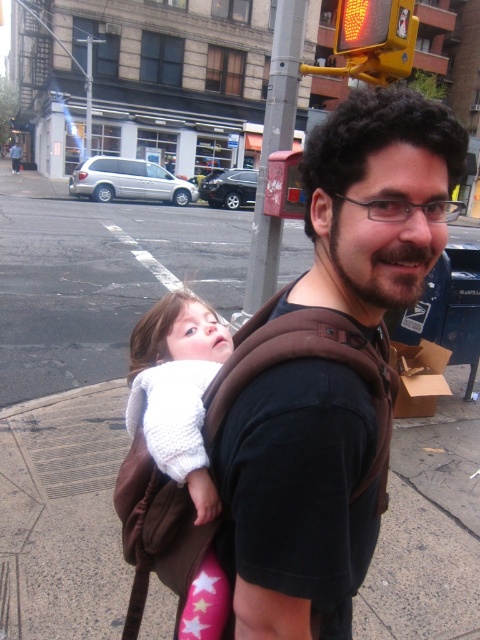
Question: Which point appears closest to the camera in this image?

Choices:
 (A) (419, 198)
 (B) (172, 410)

Answer: (A)

Question: Which point appears closest to the camera in this image?

Choices:
 (A) (337, 458)
 (B) (217, 330)

Answer: (A)

Question: Is brown fabric carrier at center to the left of white knitted sweater at center from the viewer's perspective?

Choices:
 (A) no
 (B) yes

Answer: (A)

Question: Is brown fabric carrier at center further to camera compared to white knitted sweater at center?

Choices:
 (A) yes
 (B) no

Answer: (B)

Question: Is brown fabric carrier at center to the right of white knitted sweater at center from the viewer's perspective?

Choices:
 (A) no
 (B) yes

Answer: (B)